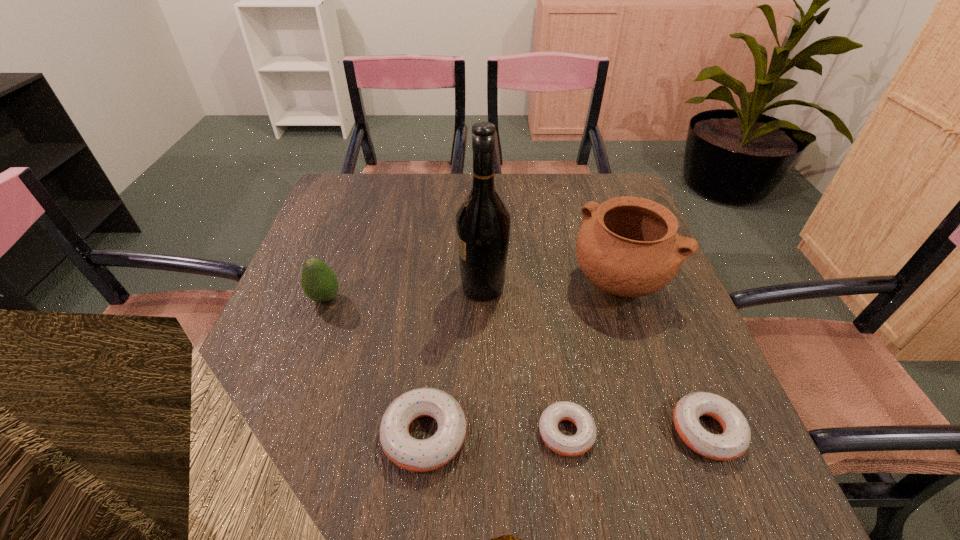
Identify the location of pottery present at the right edge. This screenshot has width=960, height=540. (628, 246).

Find the location of a particular element. This screenshot has height=540, width=960. object present at the near right corner is located at coordinates (734, 441).

The width and height of the screenshot is (960, 540). In the image, there is a desktop. What are the coordinates of `free space at the far edge` in the screenshot? It's located at (412, 215).

Where is `vacant region at the left edge of the desktop`? vacant region at the left edge of the desktop is located at coordinates (265, 351).

Where is `free space at the right edge of the desktop`? free space at the right edge of the desktop is located at coordinates (640, 367).

The height and width of the screenshot is (540, 960). What are the coordinates of `free space at the far left corner` in the screenshot? It's located at (369, 188).

Locate an element on the screen. vacant area at the far right corner is located at coordinates (623, 181).

Find the location of a particular element. This screenshot has width=960, height=540. vacant space in between the rightmost doughnut and the third tallest object is located at coordinates (516, 364).

Where is `vacant region between the shortest doughnut and the wine bottle`? This screenshot has height=540, width=960. vacant region between the shortest doughnut and the wine bottle is located at coordinates (524, 360).

The width and height of the screenshot is (960, 540). Find the location of `empty space that is in between the leftmost doughnut and the fifth tallest object`. empty space that is in between the leftmost doughnut and the fifth tallest object is located at coordinates (565, 433).